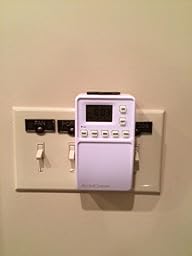
This screenshot has width=192, height=256. What are the coordinates of `digital display` in the screenshot? It's located at (99, 113).